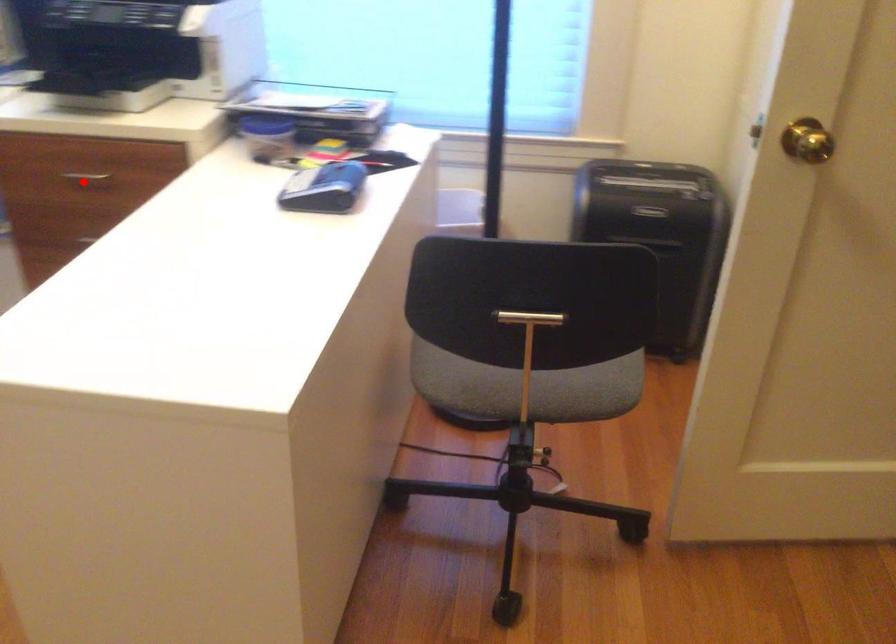
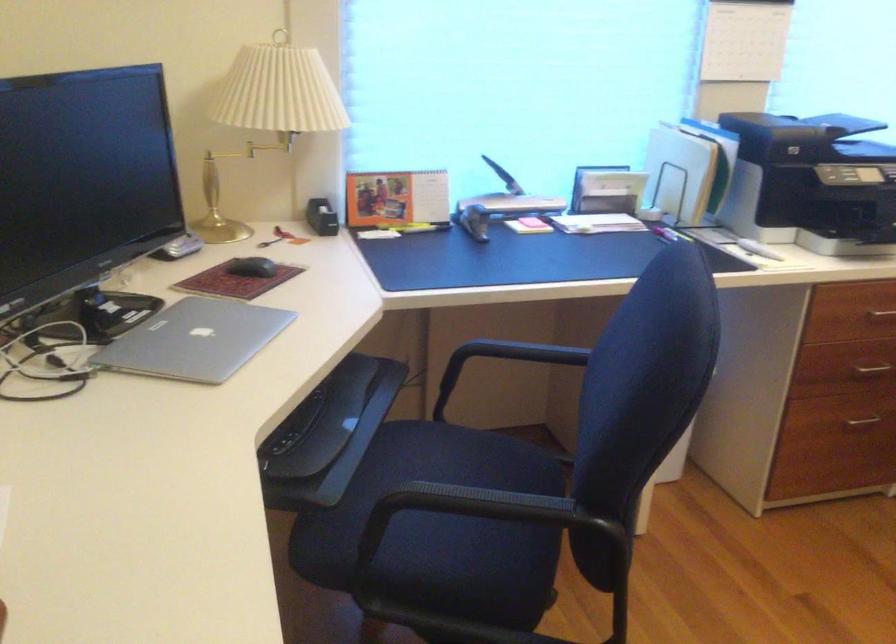
Question: I am providing you with two images of the same scene from different viewpoints. Given a red point in image1, look at the same physical point in image2. Is it:

Choices:
 (A) Closer to the viewpoint
 (B) Farther from the viewpoint

Answer: (B)